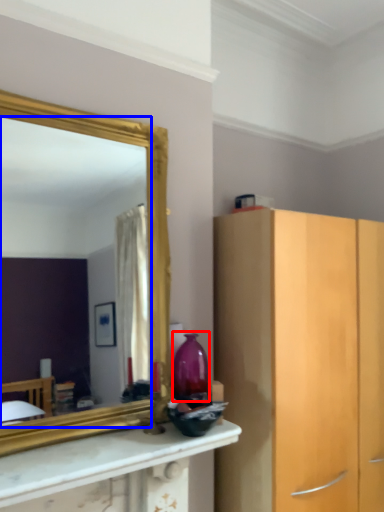
Question: Among these objects, which one is farthest to the camera, vase (highlighted by a red box) or mirror (highlighted by a blue box)?

Choices:
 (A) vase
 (B) mirror

Answer: (A)